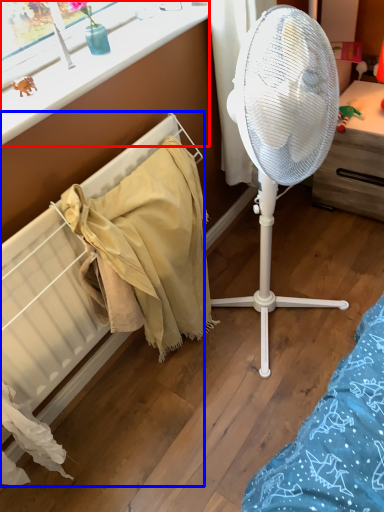
Question: Which object is closer to the camera taking this photo, window frame (highlighted by a red box) or radiator (highlighted by a blue box)?

Choices:
 (A) window frame
 (B) radiator

Answer: (B)